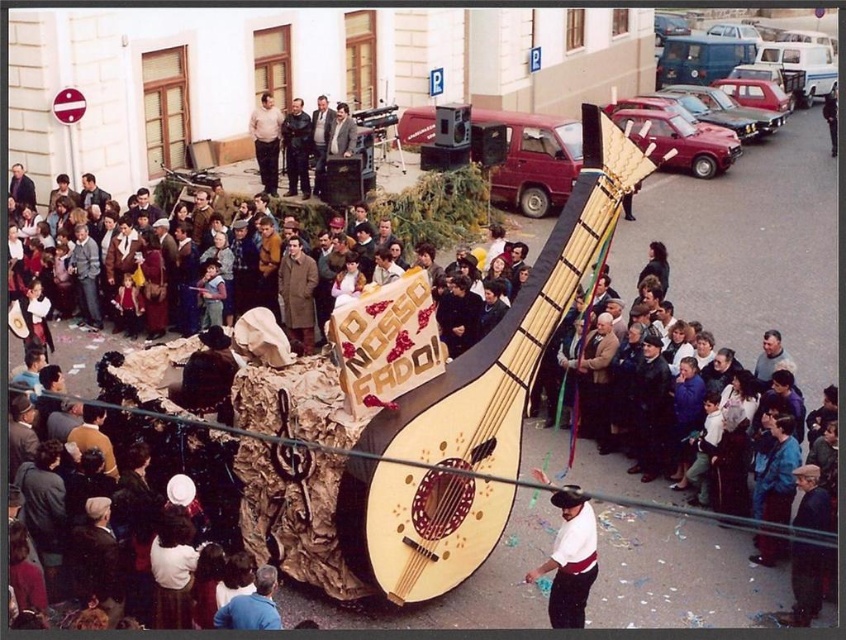
Looking at this image, is wooden lute at center positioned in front of dark blue uniform at upper center?

Yes, it is in front of dark blue uniform at upper center.

Does point (501, 433) come in front of point (305, 186)?

Yes, it is.

At what (x,y) coordinates should I click in order to perform the action: click on wooden lute at center. Please return your answer as a coordinate pair (x, y). The height and width of the screenshot is (640, 846). Looking at the image, I should click on (476, 404).

Can you confirm if white cotton shirt at lower center is thinner than light brown leather jacket at upper center?

No, white cotton shirt at lower center is not thinner than light brown leather jacket at upper center.

Between point (575, 621) and point (262, 96), which one is positioned behind?

The point (262, 96) is more distant.

The width and height of the screenshot is (846, 640). What are the coordinates of `white cotton shirt at lower center` in the screenshot? It's located at 570,561.

Is point (603, 228) positioned behind point (553, 568)?

Yes, it is.

The height and width of the screenshot is (640, 846). What do you see at coordinates (476, 404) in the screenshot?
I see `wooden lute at center` at bounding box center [476, 404].

Which is behind, point (358, 504) or point (585, 586)?

The point (585, 586) is more distant.

Find the location of `wooden lute at center`. wooden lute at center is located at coordinates (476, 404).